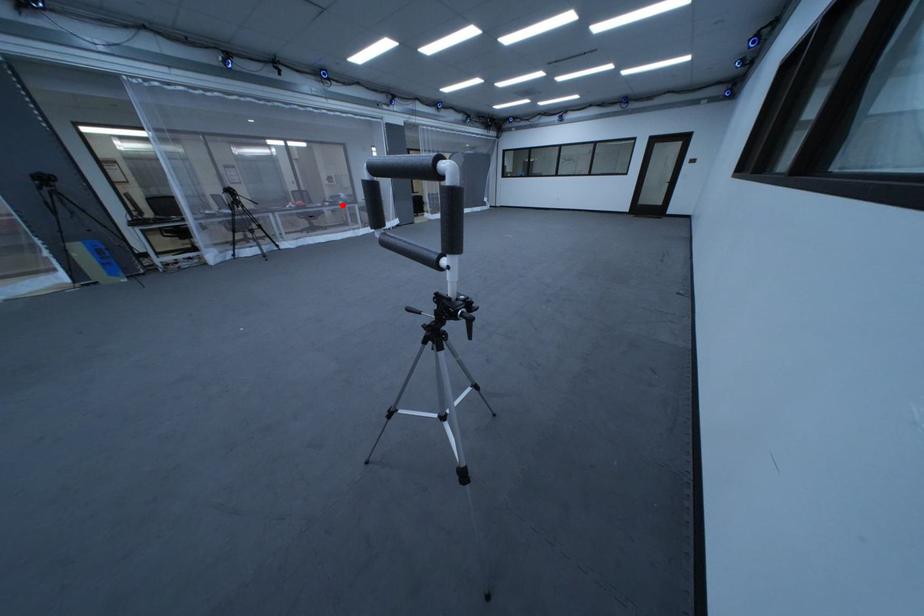
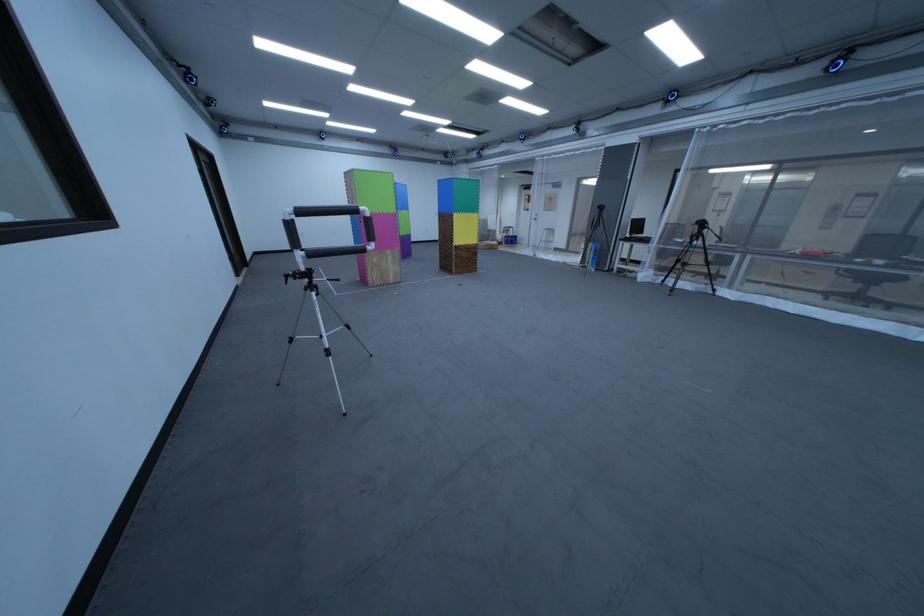
Question: I am providing you with two images of the same scene from different viewpoints. In image1, a red point is highlighted. Considering the same 3D point in image2, which of the following is correct?

Choices:
 (A) It is closer
 (B) It is farther

Answer: (B)